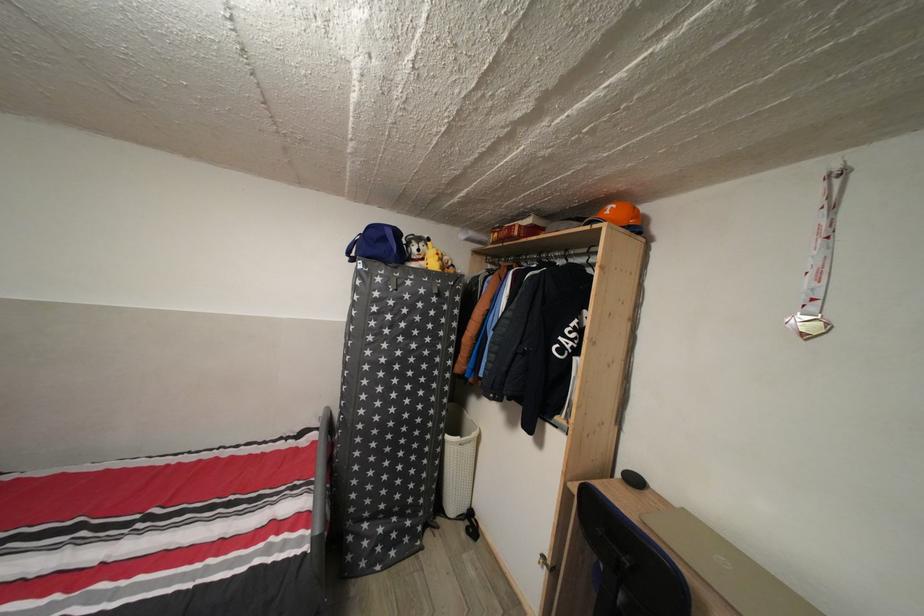
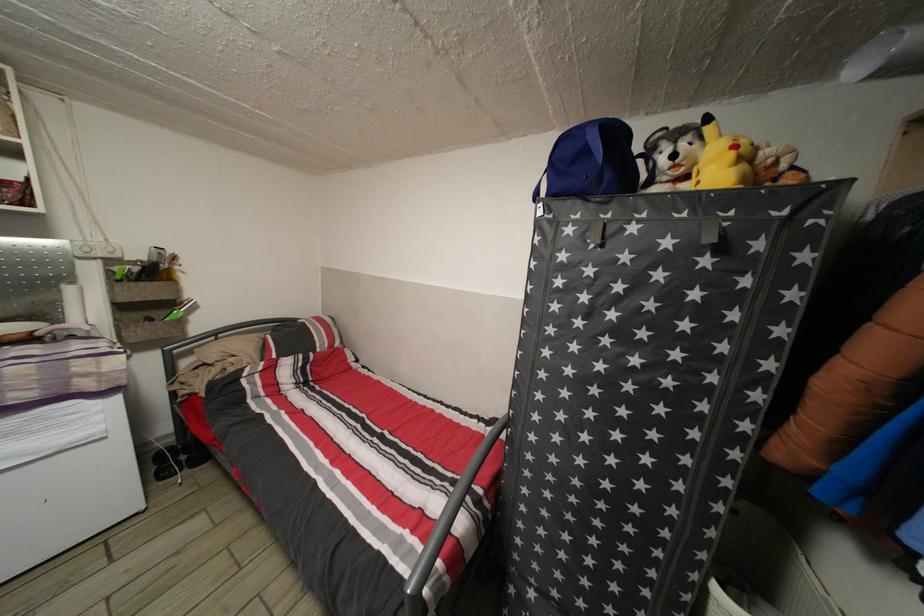
Find the pixel in the second image that matches pixel 444 264 in the first image.

(738, 161)